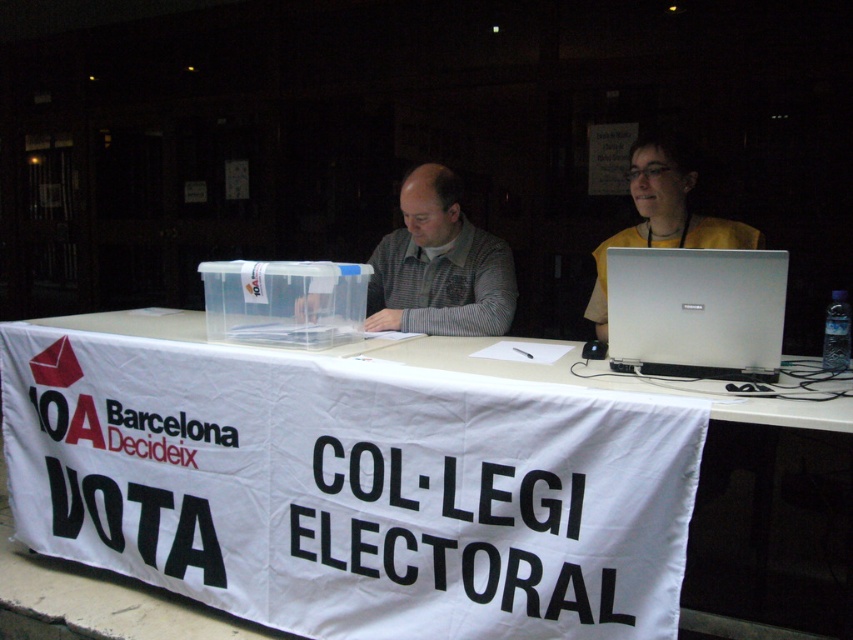
Question: Is white paper at center thinner than gray knitted sweater at center?

Choices:
 (A) no
 (B) yes

Answer: (A)

Question: Which of the following is the closest to the observer?

Choices:
 (A) yellow matte shirt at upper right
 (B) gray knitted sweater at center
 (C) silver metallic laptop at center
 (D) white paper at center

Answer: (D)

Question: Is white paper at center below gray knitted sweater at center?

Choices:
 (A) no
 (B) yes

Answer: (B)

Question: Based on their relative distances, which object is farther from the silver metallic laptop at center?

Choices:
 (A) yellow matte shirt at upper right
 (B) white paper at center
 (C) gray knitted sweater at center

Answer: (C)

Question: Which point is farther to the camera?

Choices:
 (A) white paper at center
 (B) yellow matte shirt at upper right

Answer: (B)

Question: Is white paper at center to the left of gray knitted sweater at center from the viewer's perspective?

Choices:
 (A) yes
 (B) no

Answer: (B)